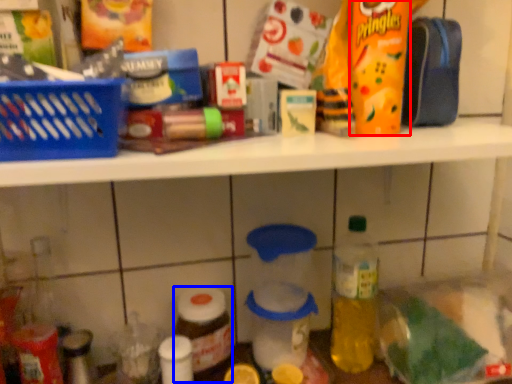
Question: Which of the following is the closest to the observer, snack (highlighted by a red box) or bottle (highlighted by a blue box)?

Choices:
 (A) snack
 (B) bottle

Answer: (A)